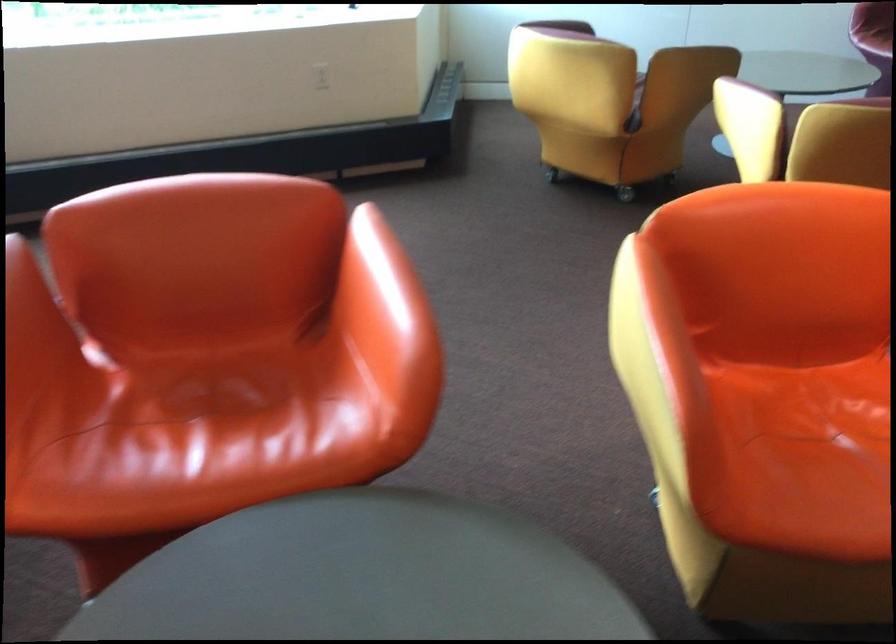
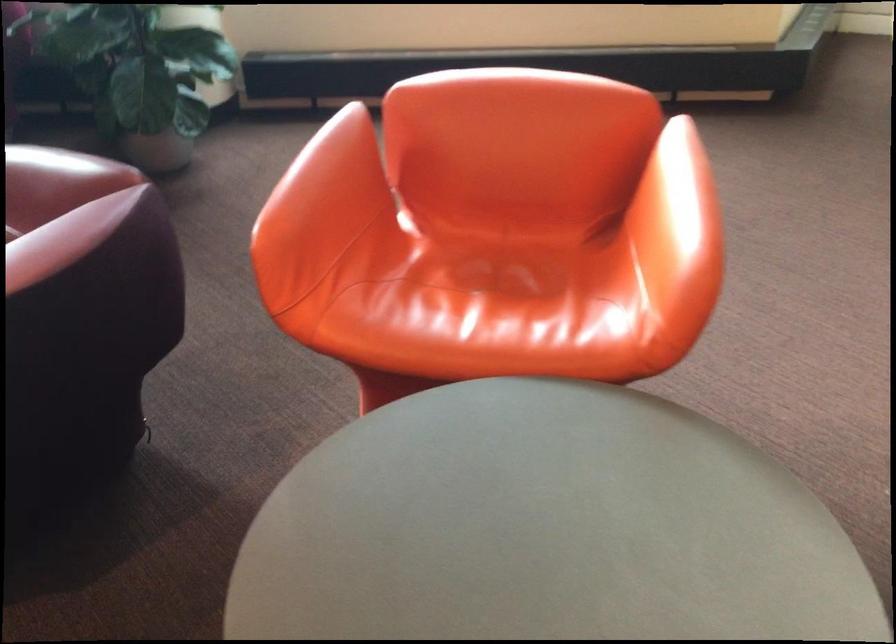
Where in the second image is the point corresponding to point (390, 290) from the first image?

(687, 199)